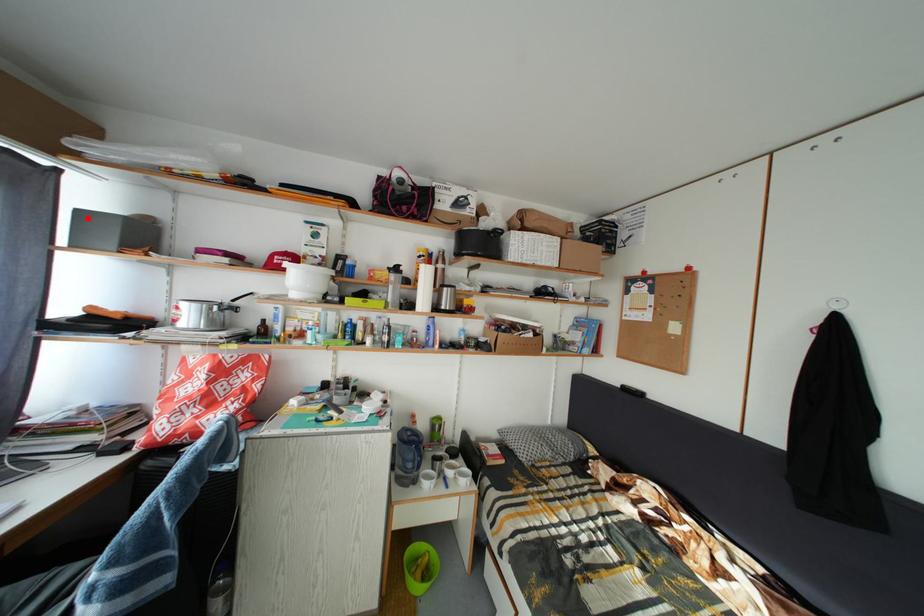
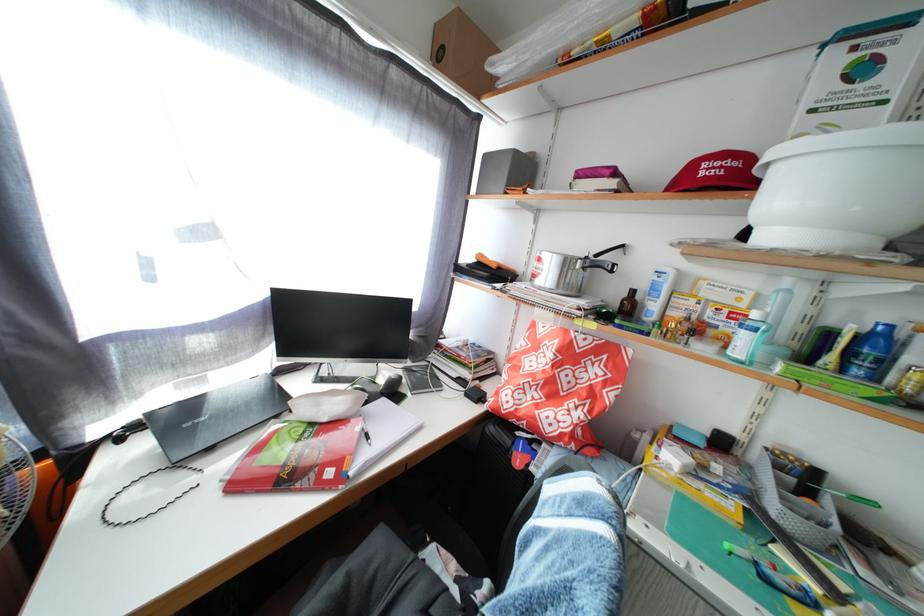
Question: I am providing you with two images of the same scene from different viewpoints. In image1, a red point is highlighted. Considering the same 3D point in image2, which of the following is correct?

Choices:
 (A) It is closer
 (B) It is farther

Answer: (A)